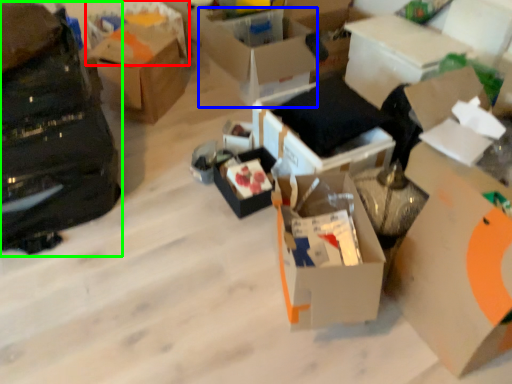
Question: Which object is positioned farthest from storage box (highlighted by a red box)? Select from box (highlighted by a blue box) and bag (highlighted by a green box).

Choices:
 (A) box
 (B) bag

Answer: (B)